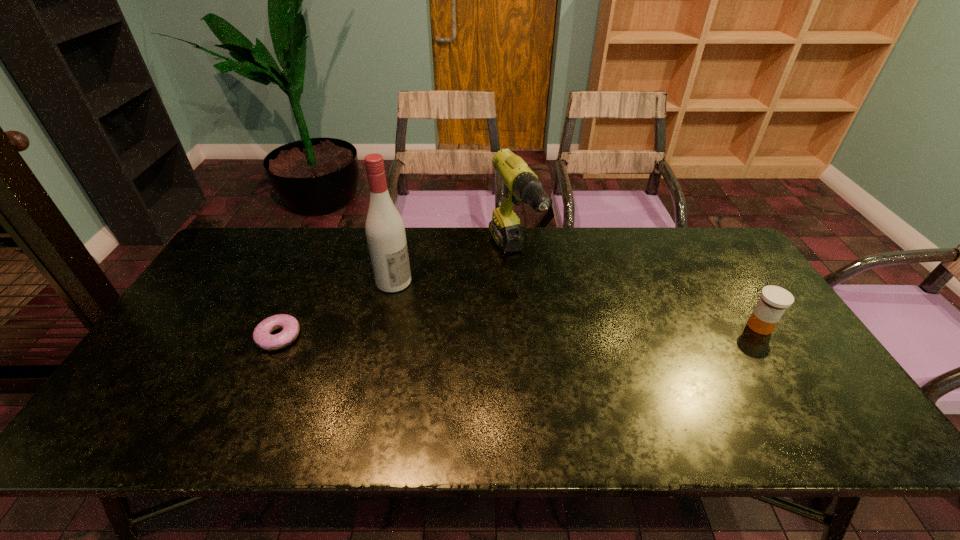
The height and width of the screenshot is (540, 960). What are the coordinates of `free spot on the desktop that is between the shortest object and the third tallest object and is positioned on the label of the alcohol` in the screenshot? It's located at (493, 332).

The width and height of the screenshot is (960, 540). What are the coordinates of `free space on the desktop that is between the doughnut and the rightmost object and is positioned on the handle side of the third object from left to right` in the screenshot? It's located at (561, 330).